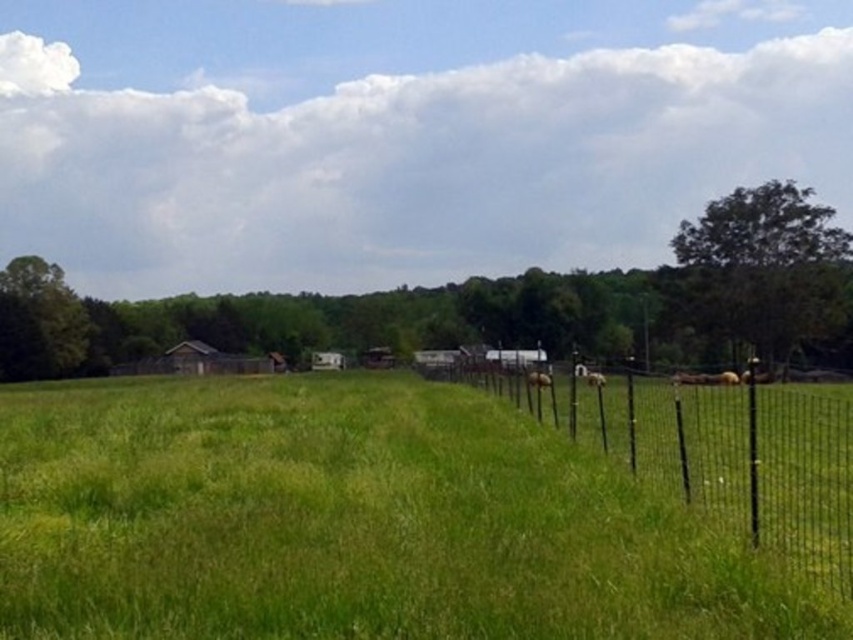
You are a photographer standing at the edge of the green grassy field at center and want to take a picture of the brown furry dog at center. Since both are in the center, how does their positioning affect the photo composition?

The green grassy field at center is in front of the brown furry dog at center, so the dog may appear slightly obscured or layered behind the field in the photo.

You are a farmer checking the layout of your land. You notice the green grassy field at center and the black wire fence at right. Which of these two features occupies more horizontal space in the image?

The green grassy field at center occupies more horizontal space than the black wire fence at right because its width surpasses that of the fence.

You are standing in the green grassy field at center and want to reach the black wire fence at right. Based on the scene, which direction should you move to get closer to the fence?

The green grassy field at center is in front of the black wire fence at right, so you should move forward towards the fence to get closer.